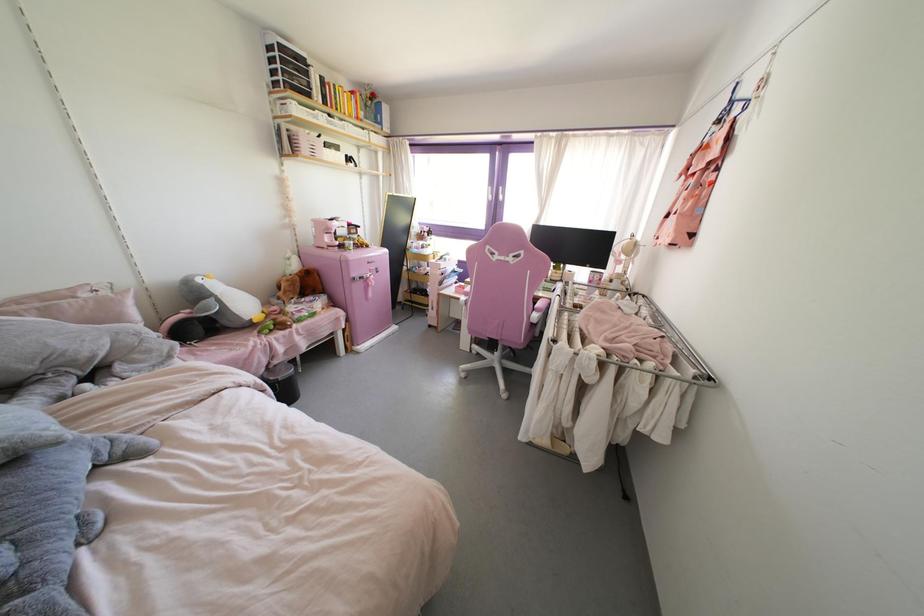
Find where to pinch the blue clothespin. Please return your answer as a coordinate pair (x, y).

(677, 342)